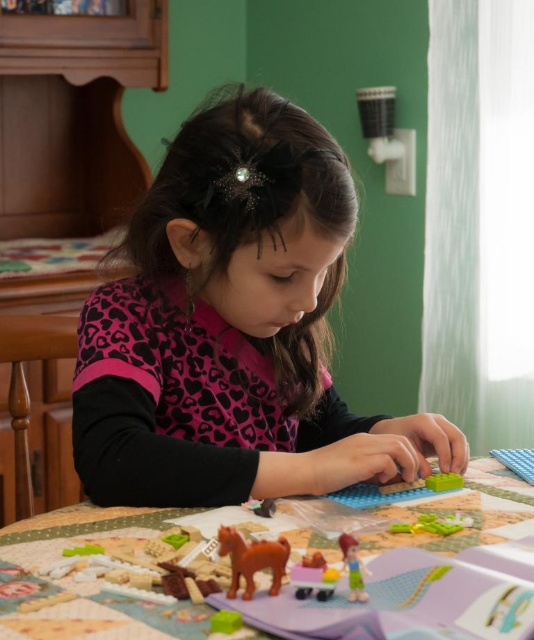
Measure the distance between point (319, 192) and camera.

Point (319, 192) and camera are 27.58 inches apart from each other.

Does pink leopard print shirt at center have a greater width compared to translucent plastic toy figure at lower center?

Yes.

The image size is (534, 640). What do you see at coordinates (234, 328) in the screenshot? I see `pink leopard print shirt at center` at bounding box center [234, 328].

Where is `pink leopard print shirt at center`? pink leopard print shirt at center is located at coordinates (234, 328).

Between point (482, 492) and point (230, 554), which one is positioned in front?

Point (230, 554) is in front.

Identify the location of wooden quilted table at center. (87, 580).

What do you see at coordinates (234, 328) in the screenshot? I see `pink leopard print shirt at center` at bounding box center [234, 328].

Between point (136, 388) and point (304, 586), which one is positioned behind?

The point (136, 388) is more distant.

You are a GUI agent. You are given a task and a screenshot of the screen. Output one action in this format:
    pyautogui.click(x=<x>, y=<y>)
    Task: Click on the pink leopard print shirt at center
    The image size is (534, 640).
    Given the screenshot: What is the action you would take?
    pyautogui.click(x=234, y=328)